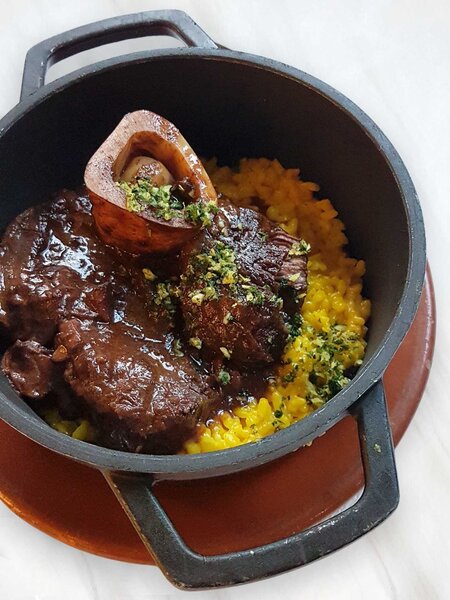
The height and width of the screenshot is (600, 450). Find the location of `white table`. white table is located at coordinates (30, 573).